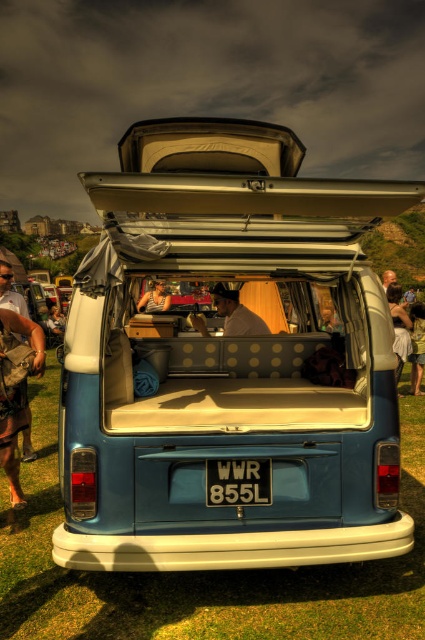
Question: Is blue fabric-covered bed at center further to the viewer compared to white cotton dress at right?

Choices:
 (A) no
 (B) yes

Answer: (A)

Question: In this image, where is brown leather bag at lower left located relative to black metal license plate at center?

Choices:
 (A) below
 (B) above

Answer: (B)

Question: Is brown leather bag at lower left positioned in front of white cotton dress at right?

Choices:
 (A) yes
 (B) no

Answer: (A)

Question: Among these points, which one is nearest to the camera?

Choices:
 (A) (397, 372)
 (B) (306, 621)
 (C) (163, 308)

Answer: (B)

Question: Which point is closer to the camera?

Choices:
 (A) (10, 337)
 (B) (220, 285)
 (C) (155, 301)

Answer: (A)

Question: Considering the real-world distances, which object is farthest from the matte black shirt at center?

Choices:
 (A) light brown leather jacket at center
 (B) white cotton dress at right
 (C) brown leather bag at lower left

Answer: (C)